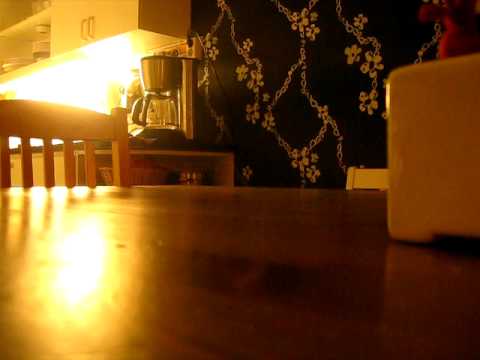
At what (x,y) coordinates should I click in order to perform the action: click on glass. Please return your answer as a coordinate pair (x, y). This screenshot has width=480, height=360. Looking at the image, I should click on (153, 109).